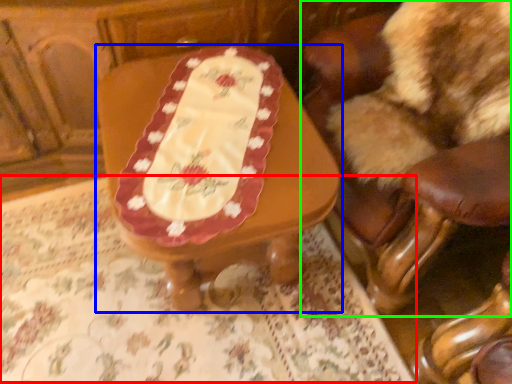
Question: Estimate the real-world distances between objects in this image. Which object is closer to tablecloth (highlighted by a red box), table (highlighted by a blue box) or chair (highlighted by a green box)?

Choices:
 (A) table
 (B) chair

Answer: (A)